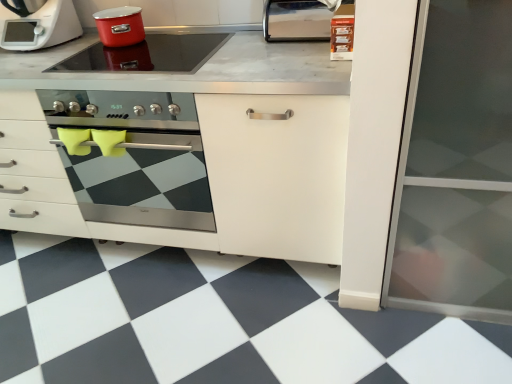
Question: From the image's perspective, does smooth glass cooktop at upper center, which is the first kitchen appliance in bottom-to-top order, appear lower than black/white checkered tile at lower center?

Choices:
 (A) no
 (B) yes

Answer: (A)

Question: Is smooth glass cooktop at upper center, which is the first kitchen appliance in bottom-to-top order, looking in the opposite direction of black/white checkered tile at lower center?

Choices:
 (A) yes
 (B) no

Answer: (B)

Question: Can black/white checkered tile at lower center be found inside smooth glass cooktop at upper center, which is the first kitchen appliance in bottom-to-top order?

Choices:
 (A) no
 (B) yes

Answer: (A)

Question: From the image's perspective, does smooth glass cooktop at upper center, which is the first kitchen appliance in bottom-to-top order, appear higher than black/white checkered tile at lower center?

Choices:
 (A) yes
 (B) no

Answer: (A)

Question: Does smooth glass cooktop at upper center, the 2th kitchen appliance positioned from the top, have a greater height compared to black/white checkered tile at lower center?

Choices:
 (A) yes
 (B) no

Answer: (B)

Question: Considering the relative sizes of smooth glass cooktop at upper center, the 2th kitchen appliance positioned from the top, and black/white checkered tile at lower center in the image provided, is smooth glass cooktop at upper center, the 2th kitchen appliance positioned from the top, thinner than black/white checkered tile at lower center?

Choices:
 (A) yes
 (B) no

Answer: (A)

Question: Considering the relative sizes of matte red pot at upper center, the second kitchen appliance positioned from the bottom, and satin silver paper towel dispenser at upper right in the image provided, is matte red pot at upper center, the second kitchen appliance positioned from the bottom, taller than satin silver paper towel dispenser at upper right?

Choices:
 (A) no
 (B) yes

Answer: (A)

Question: Is matte red pot at upper center, the second kitchen appliance positioned from the bottom, thinner than satin silver paper towel dispenser at upper right?

Choices:
 (A) yes
 (B) no

Answer: (B)

Question: Does matte red pot at upper center, the second kitchen appliance positioned from the bottom, have a greater width compared to satin silver paper towel dispenser at upper right?

Choices:
 (A) yes
 (B) no

Answer: (A)

Question: Is the position of matte red pot at upper center, the second kitchen appliance positioned from the bottom, more distant than that of satin silver paper towel dispenser at upper right?

Choices:
 (A) no
 (B) yes

Answer: (B)

Question: From the image's perspective, is matte red pot at upper center, the second kitchen appliance positioned from the bottom, above satin silver paper towel dispenser at upper right?

Choices:
 (A) no
 (B) yes

Answer: (B)

Question: Does matte red pot at upper center, the second kitchen appliance positioned from the bottom, have a smaller size compared to satin silver paper towel dispenser at upper right?

Choices:
 (A) yes
 (B) no

Answer: (A)

Question: Is white matte food processor at upper left at the right side of black/white checkered tile at lower center?

Choices:
 (A) no
 (B) yes

Answer: (A)